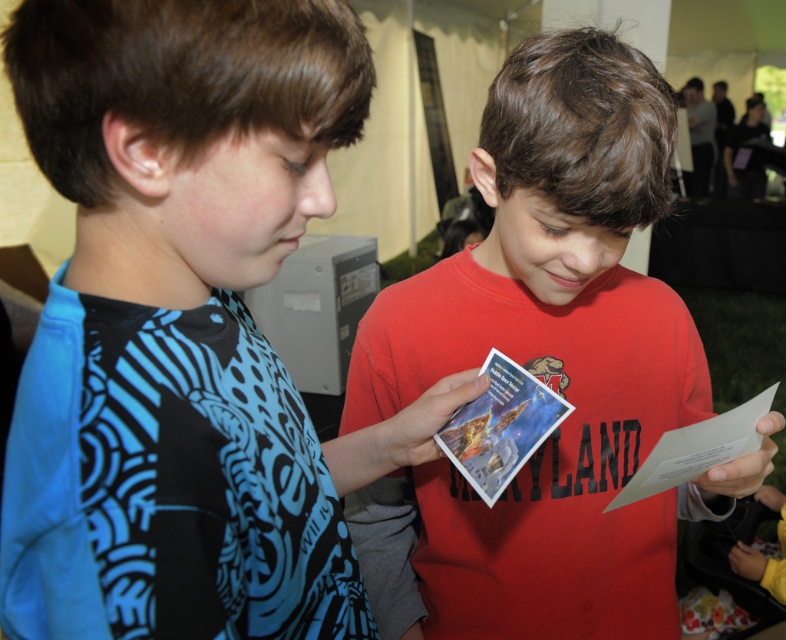
You are standing in front of the two boys examining a brochure. Which boy is wearing the blue printed shirt at left?

The boy on the left is wearing the blue printed shirt at left.

You are a photographer standing at the camera position. You want to take a photo focusing on the point closer to you. Which point should you choose between point (292, 0) and point (428, 496)?

Point (292, 0) is closer to the camera than point (428, 496), so you should choose point (292, 0) to focus on.